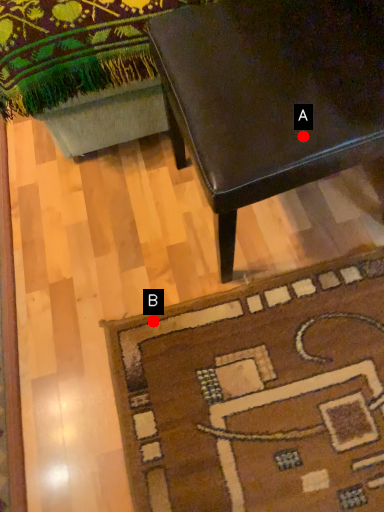
Question: Two points are circled on the image, labeled by A and B beside each circle. Which point is closer to the camera?

Choices:
 (A) A is closer
 (B) B is closer

Answer: (A)